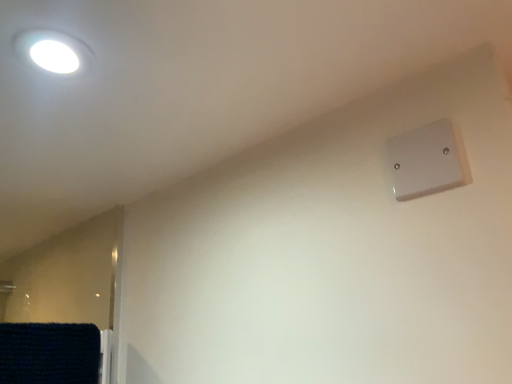
Locate an element on the screen. The image size is (512, 384). white plastic light switch at upper right is located at coordinates (426, 161).

The image size is (512, 384). Describe the element at coordinates (426, 161) in the screenshot. I see `white plastic light switch at upper right` at that location.

This screenshot has width=512, height=384. In order to click on white plastic light switch at upper right in this screenshot , I will do pyautogui.click(x=426, y=161).